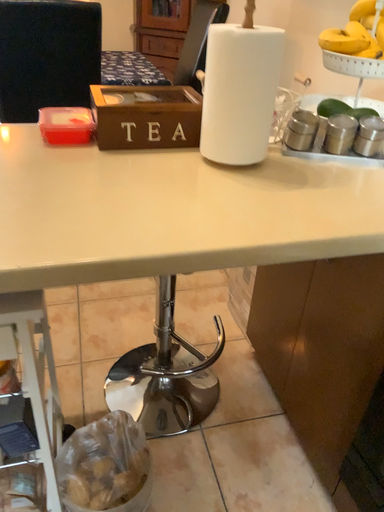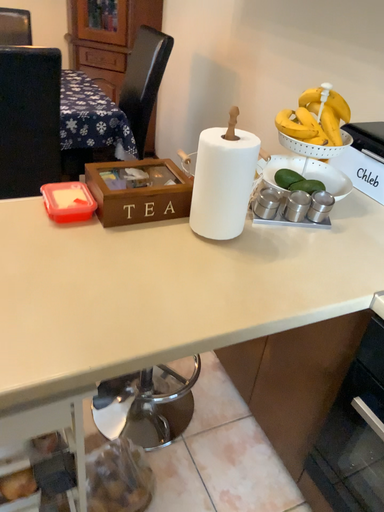
Question: How did the camera likely rotate when shooting the video?

Choices:
 (A) rotated left
 (B) rotated right

Answer: (B)